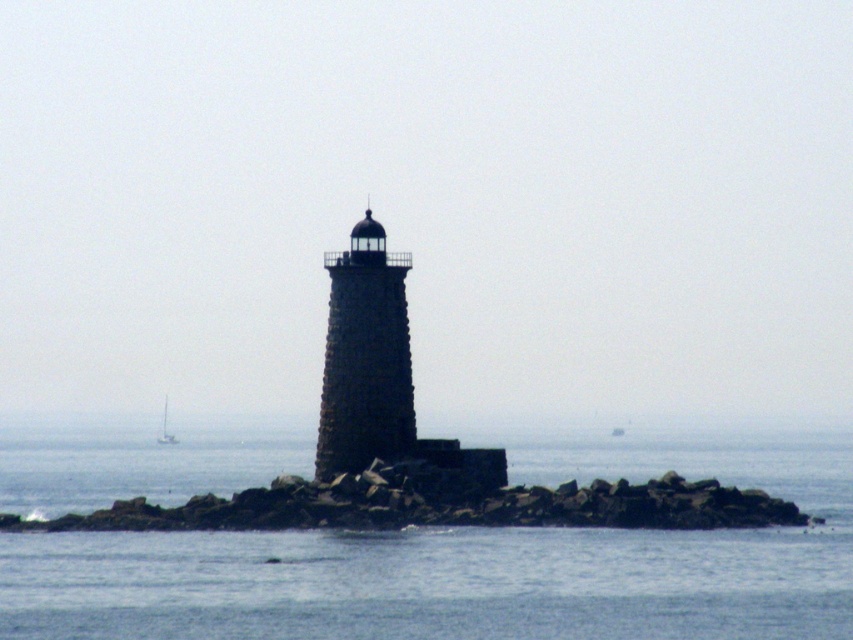
Question: Is transparent water at center above rocky at center?

Choices:
 (A) yes
 (B) no

Answer: (B)

Question: Which object is farther from the camera taking this photo?

Choices:
 (A) transparent water at center
 (B) white matte sailboat at lower left
 (C) rocky at center

Answer: (B)

Question: Which object appears closest to the camera in this image?

Choices:
 (A) rocky at center
 (B) dark gray stone lighthouse at center

Answer: (A)

Question: Which of the following is the farthest from the observer?

Choices:
 (A) transparent water at center
 (B) dark gray stone lighthouse at center

Answer: (B)

Question: Does rocky at center have a lesser width compared to dark gray stone lighthouse at center?

Choices:
 (A) yes
 (B) no

Answer: (B)

Question: Can you confirm if transparent water at center is thinner than dark gray stone lighthouse at center?

Choices:
 (A) yes
 (B) no

Answer: (B)